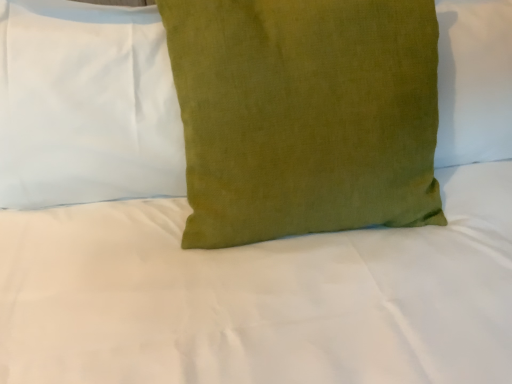
What do you see at coordinates (305, 115) in the screenshot? I see `green linen pillow at center, marked as the first pillow in a right-to-left arrangement` at bounding box center [305, 115].

The image size is (512, 384). Find the location of `green linen pillow at center, the second pillow viewed from the left`. green linen pillow at center, the second pillow viewed from the left is located at coordinates (305, 115).

The image size is (512, 384). Identify the location of green linen pillow at center, acting as the first pillow starting from the left. (86, 105).

Measure the distance between point (170, 184) and camera.

Point (170, 184) is 35.24 inches away from camera.

This screenshot has width=512, height=384. What do you see at coordinates (86, 105) in the screenshot? I see `green linen pillow at center, acting as the first pillow starting from the left` at bounding box center [86, 105].

You are a GUI agent. You are given a task and a screenshot of the screen. Output one action in this format:
    pyautogui.click(x=<x>, y=<y>)
    Task: Click on the green linen pillow at center, marked as the first pillow in a right-to-left arrangement
    This screenshot has height=384, width=512.
    Given the screenshot: What is the action you would take?
    pyautogui.click(x=305, y=115)

Considering the relative positions of green linen pillow at center, acting as the first pillow starting from the left, and green linen pillow at center, marked as the first pillow in a right-to-left arrangement, in the image provided, is green linen pillow at center, acting as the first pillow starting from the left, to the left of green linen pillow at center, marked as the first pillow in a right-to-left arrangement, from the viewer's perspective?

Yes, green linen pillow at center, acting as the first pillow starting from the left, is to the left of green linen pillow at center, marked as the first pillow in a right-to-left arrangement.

In the scene shown: Considering the positions of objects green linen pillow at center, acting as the first pillow starting from the left, and green linen pillow at center, marked as the first pillow in a right-to-left arrangement, in the image provided, who is behind, green linen pillow at center, acting as the first pillow starting from the left, or green linen pillow at center, marked as the first pillow in a right-to-left arrangement,?

green linen pillow at center, acting as the first pillow starting from the left, is further from the camera.

Which is nearer, (80, 178) or (390, 9)?

Point (80, 178) appears to be farther away from the viewer than point (390, 9).

From the image's perspective, is green linen pillow at center, the second pillow when ordered from right to left, positioned above or below green linen pillow at center, marked as the first pillow in a right-to-left arrangement?

green linen pillow at center, the second pillow when ordered from right to left, is situated higher than green linen pillow at center, marked as the first pillow in a right-to-left arrangement, in the image.

From a real-world perspective, relative to green linen pillow at center, the second pillow viewed from the left, is green linen pillow at center, the second pillow when ordered from right to left, vertically above or below?

Clearly, from a real-world perspective, green linen pillow at center, the second pillow when ordered from right to left, is above green linen pillow at center, the second pillow viewed from the left.

Based on the photo, in terms of width, does green linen pillow at center, acting as the first pillow starting from the left, look wider or thinner when compared to green linen pillow at center, the second pillow viewed from the left?

Considering their sizes, green linen pillow at center, acting as the first pillow starting from the left, looks slimmer than green linen pillow at center, the second pillow viewed from the left.

Which of these two, green linen pillow at center, the second pillow when ordered from right to left, or green linen pillow at center, marked as the first pillow in a right-to-left arrangement, stands shorter?

green linen pillow at center, the second pillow when ordered from right to left.

Between green linen pillow at center, acting as the first pillow starting from the left, and green linen pillow at center, the second pillow viewed from the left, which one has larger size?

green linen pillow at center, the second pillow viewed from the left, is bigger.

Would you say green linen pillow at center, the second pillow when ordered from right to left, is inside or outside green linen pillow at center, marked as the first pillow in a right-to-left arrangement?

green linen pillow at center, the second pillow when ordered from right to left, lies outside green linen pillow at center, marked as the first pillow in a right-to-left arrangement.

Is green linen pillow at center, the second pillow when ordered from right to left, far from green linen pillow at center, marked as the first pillow in a right-to-left arrangement?

No, green linen pillow at center, the second pillow when ordered from right to left, is not far from green linen pillow at center, marked as the first pillow in a right-to-left arrangement.

Is green linen pillow at center, acting as the first pillow starting from the left, facing towards green linen pillow at center, the second pillow viewed from the left?

No.

How different are the orientations of green linen pillow at center, acting as the first pillow starting from the left, and green linen pillow at center, marked as the first pillow in a right-to-left arrangement, in degrees?

green linen pillow at center, acting as the first pillow starting from the left, and green linen pillow at center, marked as the first pillow in a right-to-left arrangement, are facing 0.0981 degrees away from each other.

How far apart are green linen pillow at center, acting as the first pillow starting from the left, and green linen pillow at center, the second pillow viewed from the left?

They are 24.29 centimeters apart.

Where is `pillow in front of the green linen pillow at center, the second pillow when ordered from right to left`? pillow in front of the green linen pillow at center, the second pillow when ordered from right to left is located at coordinates (305, 115).

Consider the image. Is green linen pillow at center, the second pillow viewed from the left, to the right of green linen pillow at center, acting as the first pillow starting from the left, from the viewer's perspective?

Yes, green linen pillow at center, the second pillow viewed from the left, is to the right of green linen pillow at center, acting as the first pillow starting from the left.

Which object is further away from the camera taking this photo, green linen pillow at center, the second pillow viewed from the left, or green linen pillow at center, acting as the first pillow starting from the left?

green linen pillow at center, acting as the first pillow starting from the left, is further away from the camera.

Considering the positions of points (409, 103) and (159, 122), is point (409, 103) farther from camera compared to point (159, 122)?

That is False.

From the image's perspective, which one is positioned higher, green linen pillow at center, marked as the first pillow in a right-to-left arrangement, or green linen pillow at center, the second pillow when ordered from right to left?

green linen pillow at center, the second pillow when ordered from right to left, appears higher in the image.

From a real-world perspective, is green linen pillow at center, marked as the first pillow in a right-to-left arrangement, over green linen pillow at center, acting as the first pillow starting from the left?

No, from a real-world perspective, green linen pillow at center, marked as the first pillow in a right-to-left arrangement, is not on top of green linen pillow at center, acting as the first pillow starting from the left.

Which of these two, green linen pillow at center, the second pillow viewed from the left, or green linen pillow at center, acting as the first pillow starting from the left, is wider?

Wider between the two is green linen pillow at center, the second pillow viewed from the left.

Who is taller, green linen pillow at center, marked as the first pillow in a right-to-left arrangement, or green linen pillow at center, the second pillow when ordered from right to left?

Standing taller between the two is green linen pillow at center, marked as the first pillow in a right-to-left arrangement.

Between green linen pillow at center, marked as the first pillow in a right-to-left arrangement, and green linen pillow at center, acting as the first pillow starting from the left, which one has smaller size?

green linen pillow at center, acting as the first pillow starting from the left.

Would you say green linen pillow at center, the second pillow when ordered from right to left, is part of green linen pillow at center, marked as the first pillow in a right-to-left arrangement,'s contents?

No, green linen pillow at center, marked as the first pillow in a right-to-left arrangement, does not contain green linen pillow at center, the second pillow when ordered from right to left.

Is green linen pillow at center, marked as the first pillow in a right-to-left arrangement, with green linen pillow at center, the second pillow when ordered from right to left?

green linen pillow at center, marked as the first pillow in a right-to-left arrangement, and green linen pillow at center, the second pillow when ordered from right to left, are clearly separated.

Could you tell me if green linen pillow at center, marked as the first pillow in a right-to-left arrangement, is turned towards green linen pillow at center, acting as the first pillow starting from the left?

No, green linen pillow at center, marked as the first pillow in a right-to-left arrangement, is not facing towards green linen pillow at center, acting as the first pillow starting from the left.

In the scene shown: Could you measure the distance between green linen pillow at center, the second pillow viewed from the left, and green linen pillow at center, the second pillow when ordered from right to left?

The distance of green linen pillow at center, the second pillow viewed from the left, from green linen pillow at center, the second pillow when ordered from right to left, is 9.56 inches.

The height and width of the screenshot is (384, 512). What are the coordinates of `pillow in front of the green linen pillow at center, acting as the first pillow starting from the left` in the screenshot? It's located at (305, 115).

The width and height of the screenshot is (512, 384). In order to click on pillow located on the left of green linen pillow at center, marked as the first pillow in a right-to-left arrangement in this screenshot , I will do `click(86, 105)`.

You are a GUI agent. You are given a task and a screenshot of the screen. Output one action in this format:
    pyautogui.click(x=<x>, y=<y>)
    Task: Click on the pillow located above the green linen pillow at center, marked as the first pillow in a right-to-left arrangement (from the image's perspective)
    
    Given the screenshot: What is the action you would take?
    pyautogui.click(x=86, y=105)